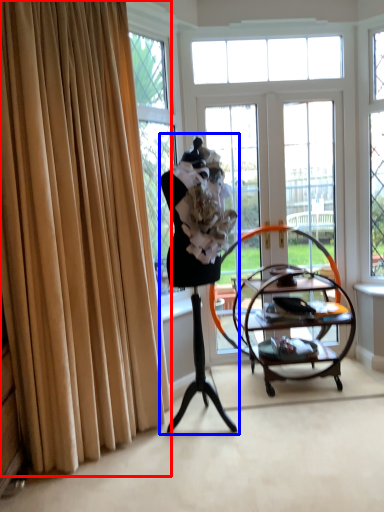
Question: Which object appears closest to the camera in this image, curtain (highlighted by a red box) or woman (highlighted by a blue box)?

Choices:
 (A) curtain
 (B) woman

Answer: (A)